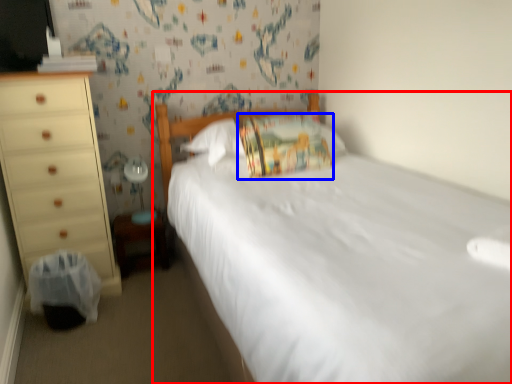
Question: Which of the following is the farthest to the observer, bed (highlighted by a red box) or pillow (highlighted by a blue box)?

Choices:
 (A) bed
 (B) pillow

Answer: (B)